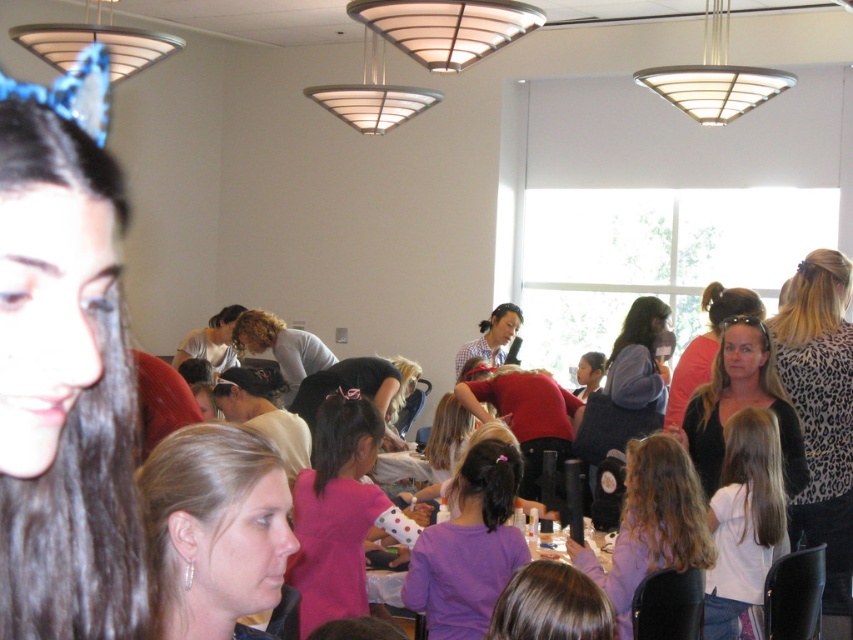
The height and width of the screenshot is (640, 853). What do you see at coordinates (469, 547) in the screenshot? I see `purple polka dot shirt at center` at bounding box center [469, 547].

Is the position of purple polka dot shirt at center more distant than that of smooth brown hair at center?

Yes, purple polka dot shirt at center is further from the viewer.

I want to click on purple polka dot shirt at center, so click(x=469, y=547).

Can you confirm if leopard print shirt at right is smaller than light gray shirt at center?

Incorrect, leopard print shirt at right is not smaller in size than light gray shirt at center.

Is leopard print shirt at right positioned behind light gray shirt at center?

No, leopard print shirt at right is in front of light gray shirt at center.

You are a GUI agent. You are given a task and a screenshot of the screen. Output one action in this format:
    pyautogui.click(x=<x>, y=<y>)
    Task: Click on the leopard print shirt at right
    This screenshot has height=640, width=853.
    Given the screenshot: What is the action you would take?
    pyautogui.click(x=820, y=412)

Between point (753, 433) and point (495, 404), which one is positioned behind?

The point (495, 404) is more distant.

Describe the element at coordinates (743, 520) in the screenshot. I see `white matte shirt at lower right` at that location.

Is point (726, 442) farther from viewer compared to point (531, 422)?

No, (726, 442) is in front of (531, 422).

Locate an element on the screen. This screenshot has height=640, width=853. white matte shirt at lower right is located at coordinates (743, 520).